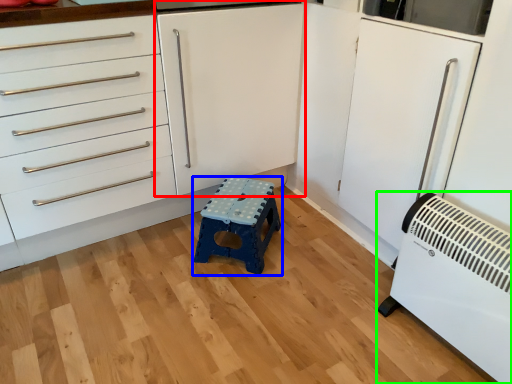
Question: Estimate the real-world distances between objects in this image. Which object is farther from cabinetry (highlighted by a red box), furniture (highlighted by a blue box) or home appliance (highlighted by a green box)?

Choices:
 (A) furniture
 (B) home appliance

Answer: (B)